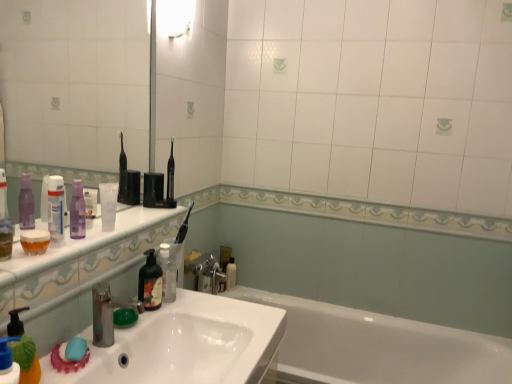
Where is `vacant space in front of black plastic toothbrush at upper center`? vacant space in front of black plastic toothbrush at upper center is located at coordinates (147, 215).